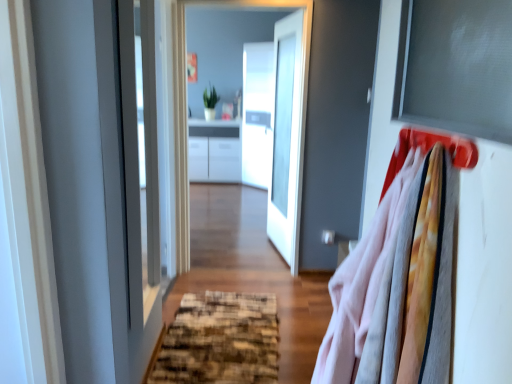
Identify the location of transparent glass door at center. tap(139, 180).

What is the approximate width of transparent glass door at center?

transparent glass door at center is 1.38 inches in width.

At what (x,y) coordinates should I click in order to perform the action: click on soft cotton shirts at right. Please return your answer as a coordinate pair (x, y). The height and width of the screenshot is (384, 512). Looking at the image, I should click on (399, 281).

In order to face transparent glass door at center, should I rotate leftwards or rightwards?

You should rotate left by 1.608 degrees.

Describe the element at coordinates (456, 66) in the screenshot. I see `matte gray window screen at upper right` at that location.

What is the approximate height of matte gray window screen at upper right?

matte gray window screen at upper right is 9.95 inches tall.

Locate an element on the screen. white glossy door at center is located at coordinates (286, 137).

I want to click on matte plastic hanger at upper right, so click(x=431, y=147).

Would you say transparent glass door at center is inside or outside transparent glass door at center?

transparent glass door at center cannot be found inside transparent glass door at center.

In order to click on glass door on the left side of transparent glass door at center in this screenshot , I will do `click(139, 180)`.

Which of these two, transparent glass door at center or transparent glass door at center, is wider?

With larger width is transparent glass door at center.

Does transparent glass door at center have a smaller size compared to transparent glass door at center?

Incorrect, transparent glass door at center is not smaller in size than transparent glass door at center.

From the image's perspective, which is below, transparent glass door at center or textured brown doormat at center?

From the image's view, textured brown doormat at center is below.

Looking at this image, does transparent glass door at center have a smaller size compared to textured brown doormat at center?

Incorrect, transparent glass door at center is not smaller in size than textured brown doormat at center.

Does transparent glass door at center turn towards textured brown doormat at center?

Yes, transparent glass door at center is turned towards textured brown doormat at center.

Does transparent glass door at center have a greater height compared to textured brown doormat at center?

Yes, transparent glass door at center is taller than textured brown doormat at center.

Is matte plastic hanger at upper right at the back of transparent glass door at center?

transparent glass door at center does not have its back to matte plastic hanger at upper right.

The height and width of the screenshot is (384, 512). I want to click on hanger located below the transparent glass door at center (from the image's perspective), so click(x=431, y=147).

From their relative heights in the image, would you say transparent glass door at center is taller or shorter than matte plastic hanger at upper right?

Clearly, transparent glass door at center is taller compared to matte plastic hanger at upper right.

Considering the relative sizes of white glossy door at center and matte gray window screen at upper right in the image provided, is white glossy door at center smaller than matte gray window screen at upper right?

Actually, white glossy door at center might be larger than matte gray window screen at upper right.

From a real-world perspective, which is physically above, white glossy door at center or matte gray window screen at upper right?

matte gray window screen at upper right, from a real-world perspective.

From the image's perspective, is white glossy door at center beneath matte gray window screen at upper right?

No.

In the scene shown: Between white glossy door at center and matte gray window screen at upper right, which one has more height?

white glossy door at center is taller.

Does white glossy door at center have a lesser height compared to matte plastic hanger at upper right?

No.

This screenshot has height=384, width=512. Identify the location of hanger above the white glossy door at center (from a real-world perspective). (431, 147).

Would you say white glossy door at center is outside matte plastic hanger at upper right?

Yes.

Between white glossy door at center and matte plastic hanger at upper right, which one has smaller size?

With smaller size is matte plastic hanger at upper right.

Is textured brown doormat at center taller or shorter than matte plastic hanger at upper right?

Clearly, textured brown doormat at center is shorter compared to matte plastic hanger at upper right.

From the image's perspective, is textured brown doormat at center located above matte plastic hanger at upper right?

No, from the image's perspective, textured brown doormat at center is not over matte plastic hanger at upper right.

From a real-world perspective, which is physically below, textured brown doormat at center or matte plastic hanger at upper right?

textured brown doormat at center, from a real-world perspective.

Does point (173, 347) appear closer or farther from the camera than point (405, 131)?

Point (173, 347).

Does matte gray window screen at upper right turn towards textured brown doormat at center?

No, matte gray window screen at upper right is not aimed at textured brown doormat at center.

How many degrees apart are the facing directions of matte gray window screen at upper right and textured brown doormat at center?

A: 89 degrees separate the facing orientations of matte gray window screen at upper right and textured brown doormat at center.

In the scene shown: From the image's perspective, which is below, matte gray window screen at upper right or textured brown doormat at center?

textured brown doormat at center.

Looking at this image, between matte gray window screen at upper right and textured brown doormat at center, which one has larger width?

textured brown doormat at center.

Identify the location of glass door in front of the transparent glass door at center. (139, 180).

I want to click on window located on the right of textured brown doormat at center, so click(186, 120).

When comparing their distances from soft cotton shirts at right, does textured brown doormat at center or matte plastic hanger at upper right seem closer?

matte plastic hanger at upper right is closer to soft cotton shirts at right.

Which object lies further to the anchor point matte plastic hanger at upper right, white glossy door at center or textured brown doormat at center?

The object further to matte plastic hanger at upper right is white glossy door at center.

Considering their positions, is matte plastic hanger at upper right positioned further to transparent glass door at center than matte gray window screen at upper right?

matte plastic hanger at upper right lies further to transparent glass door at center than the other object.

Based on their spatial positions, is white glossy door at center or matte gray window screen at upper right closer to matte plastic hanger at upper right?

matte gray window screen at upper right is positioned closer to the anchor matte plastic hanger at upper right.

Which object lies nearer to the anchor point white glossy door at center, transparent glass door at center or textured brown doormat at center?

Among the two, transparent glass door at center is located nearer to white glossy door at center.

Considering their positions, is transparent glass door at center positioned closer to soft cotton shirts at right than textured brown doormat at center?

textured brown doormat at center lies closer to soft cotton shirts at right than the other object.

Looking at the image, which one is located further to transparent glass door at center, matte gray window screen at upper right or matte plastic hanger at upper right?

matte plastic hanger at upper right lies further to transparent glass door at center than the other object.

Which object lies further to the anchor point textured brown doormat at center, soft cotton shirts at right or matte gray window screen at upper right?

matte gray window screen at upper right is further to textured brown doormat at center.

You are a GUI agent. You are given a task and a screenshot of the screen. Output one action in this format:
    pyautogui.click(x=<x>, y=<y>)
    Task: Click on the doormat positioned between soft cotton shirts at right and transparent glass door at center from near to far
    
    Given the screenshot: What is the action you would take?
    pyautogui.click(x=220, y=341)

The width and height of the screenshot is (512, 384). Identify the location of hanger between transparent glass door at center and matte gray window screen at upper right in the horizontal direction. (431, 147).

Identify the location of doormat positioned between matte gray window screen at upper right and transparent glass door at center from near to far. (220, 341).

Locate an element on the screen. window between matte plastic hanger at upper right and white glossy door at center along the z-axis is located at coordinates (186, 120).